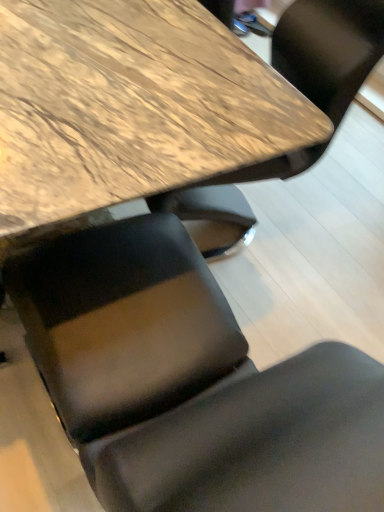
Question: From a real-world perspective, is matte black chair at lower center physically located above or below wooden table at upper center?

Choices:
 (A) below
 (B) above

Answer: (B)

Question: Considering the positions of matte black chair at lower center and wooden table at upper center in the image, is matte black chair at lower center wider or thinner than wooden table at upper center?

Choices:
 (A) wide
 (B) thin

Answer: (B)

Question: Does point (210, 342) appear closer or farther from the camera than point (69, 189)?

Choices:
 (A) closer
 (B) farther

Answer: (B)

Question: Is point [54, 156] closer or farther from the camera than point [18, 281]?

Choices:
 (A) farther
 (B) closer

Answer: (B)

Question: In the image, is wooden table at upper center on the left side or the right side of matte black chair at lower center?

Choices:
 (A) right
 (B) left

Answer: (B)

Question: Is wooden table at upper center in front of or behind matte black chair at lower center in the image?

Choices:
 (A) front
 (B) behind

Answer: (B)

Question: Considering the positions of wooden table at upper center and matte black chair at lower center in the image, is wooden table at upper center taller or shorter than matte black chair at lower center?

Choices:
 (A) short
 (B) tall

Answer: (A)